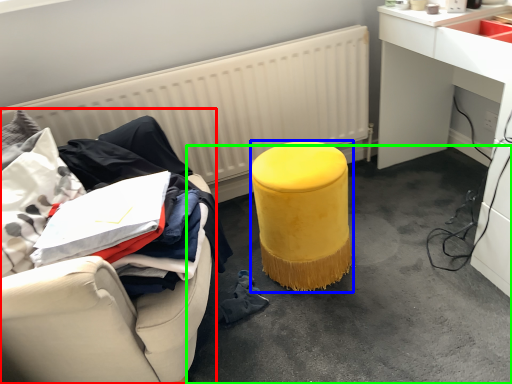
Question: Estimate the real-world distances between objects in this image. Which object is closer to furniture (highlighted by a red box), stool (highlighted by a blue box) or concrete (highlighted by a green box)?

Choices:
 (A) stool
 (B) concrete

Answer: (A)